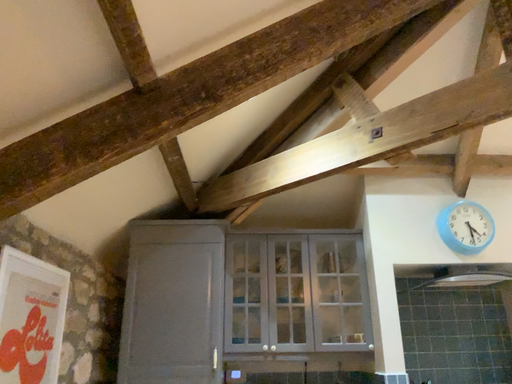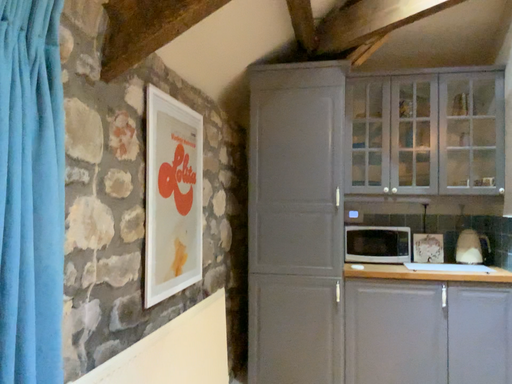
Question: How did the camera likely rotate when shooting the video?

Choices:
 (A) rotated left
 (B) rotated right

Answer: (A)